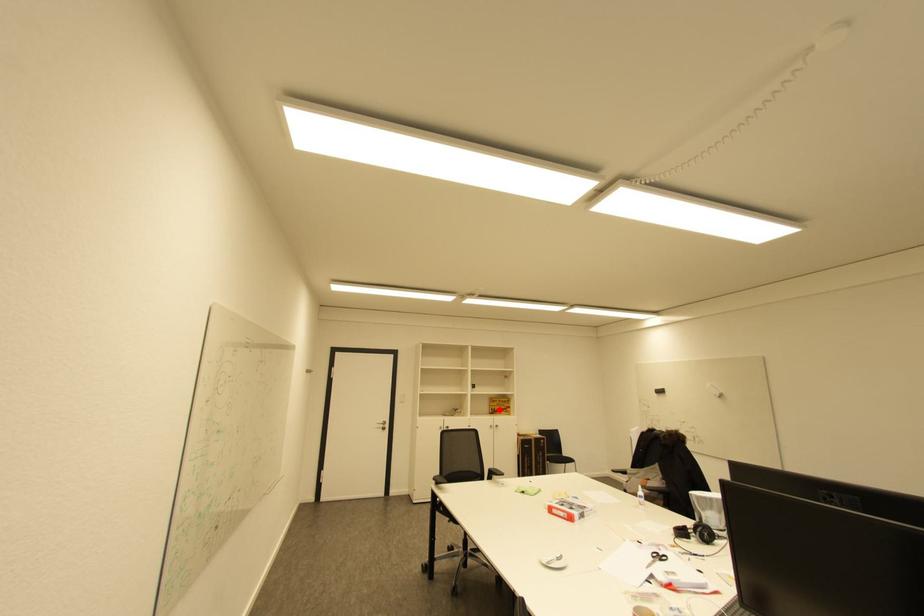
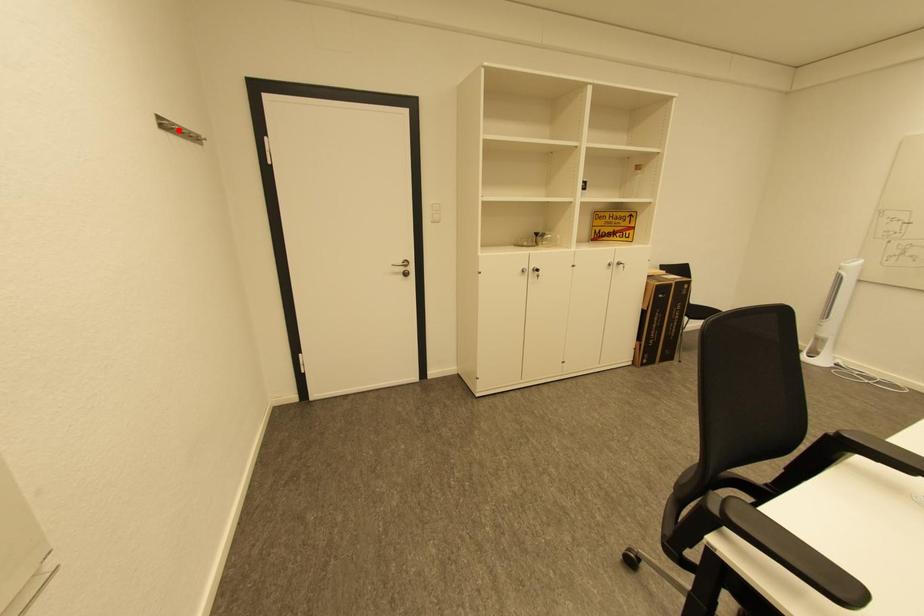
I am providing you with two images of the same scene from different viewpoints. A red point is marked on the first image and another point is marked on the second image. Do the highlighted points in image1 and image2 indicate the same real-world spot?

No